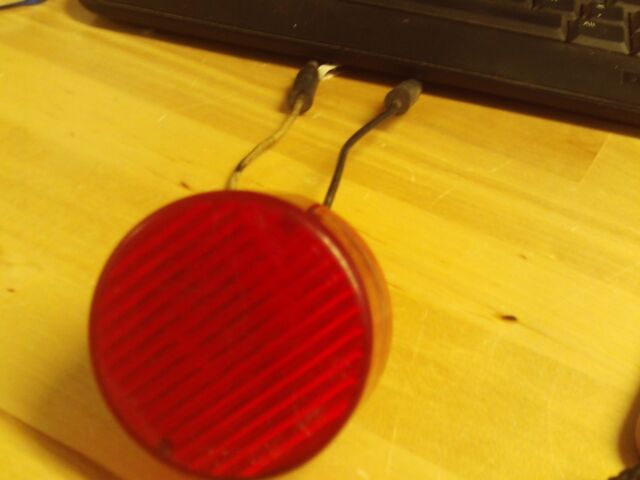
Locate an element on the screen. Image resolution: width=640 pixels, height=480 pixels. yellow floor is located at coordinates (502, 279), (530, 340).